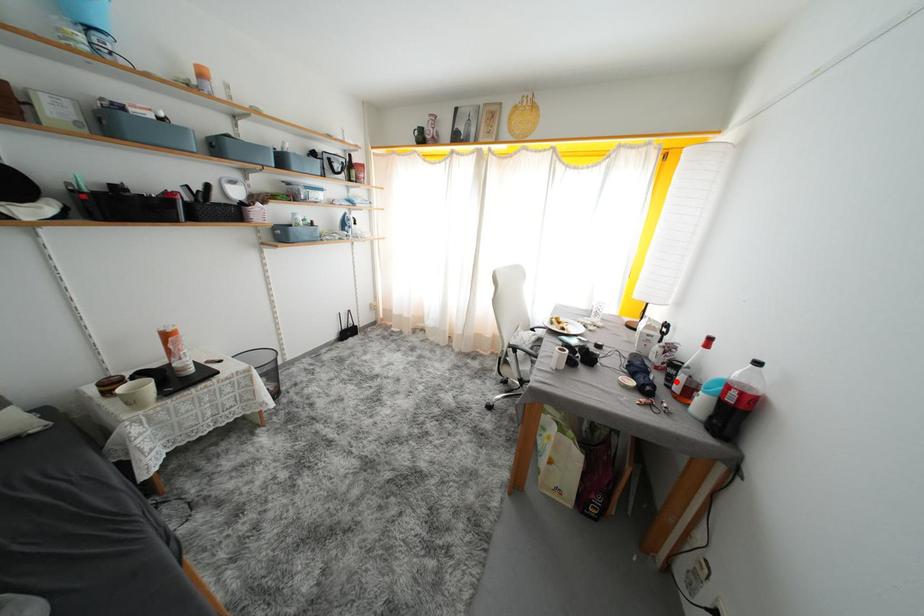
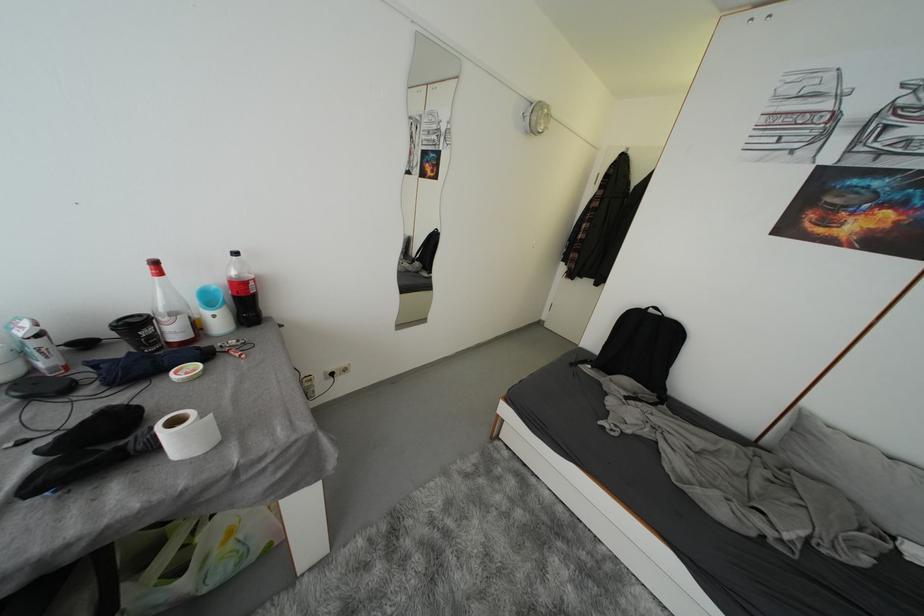
In the second image, find the point that corresponds to the highlighted location in the first image.

(162, 342)